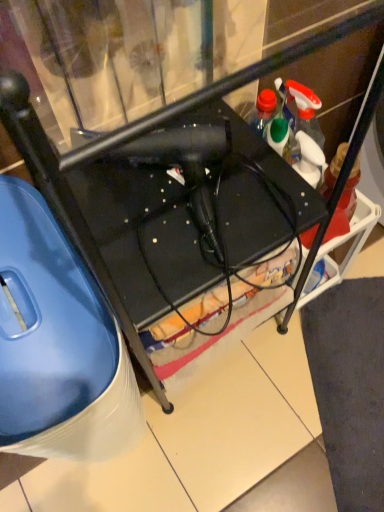
In order to face matte black swivel chair at left, should I rotate leftwards or rightwards?

Turn left approximately 18.682 degrees to face it.

You are a GUI agent. You are given a task and a screenshot of the screen. Output one action in this format:
    pyautogui.click(x=<x>, y=<y>)
    Task: Click on the matte black swivel chair at left
    Image resolution: width=384 pixels, height=512 pixels.
    Given the screenshot: What is the action you would take?
    pyautogui.click(x=58, y=344)

What is the approximate height of matte black swivel chair at left?

matte black swivel chair at left is 24.20 inches tall.

Describe the element at coordinates (58, 344) in the screenshot. This screenshot has width=384, height=512. I see `matte black swivel chair at left` at that location.

Where is `matte black swivel chair at left`? matte black swivel chair at left is located at coordinates (x=58, y=344).